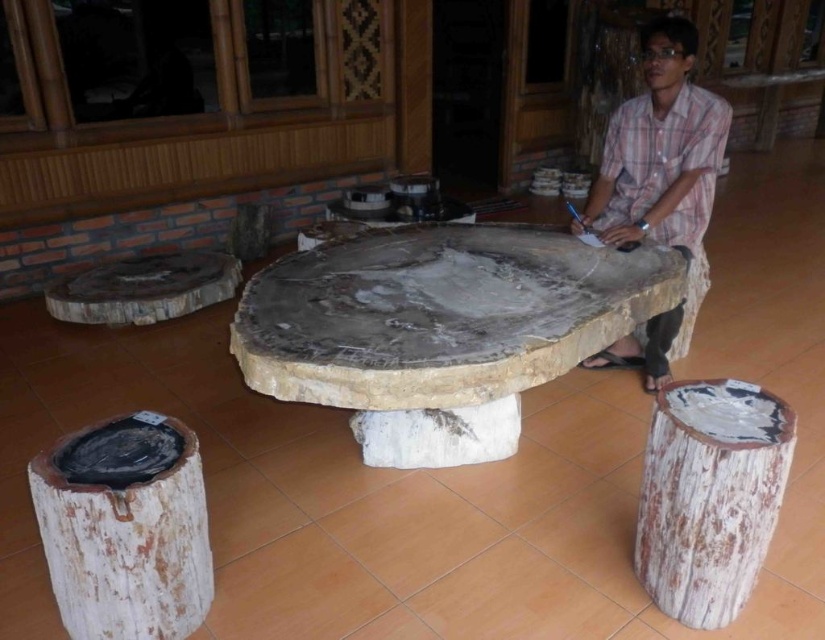
Question: Can you confirm if natural stone table at center is positioned above plaid shirt at center?

Choices:
 (A) no
 (B) yes

Answer: (A)

Question: Does natural stone table at center have a smaller size compared to plaid shirt at center?

Choices:
 (A) no
 (B) yes

Answer: (A)

Question: Does natural stone table at center have a larger size compared to plaid shirt at center?

Choices:
 (A) no
 (B) yes

Answer: (B)

Question: Which point is closer to the camera taking this photo?

Choices:
 (A) (463, 385)
 (B) (615, 160)

Answer: (A)

Question: Which of the following is the closest to the observer?

Choices:
 (A) (710, 176)
 (B) (616, 256)

Answer: (B)